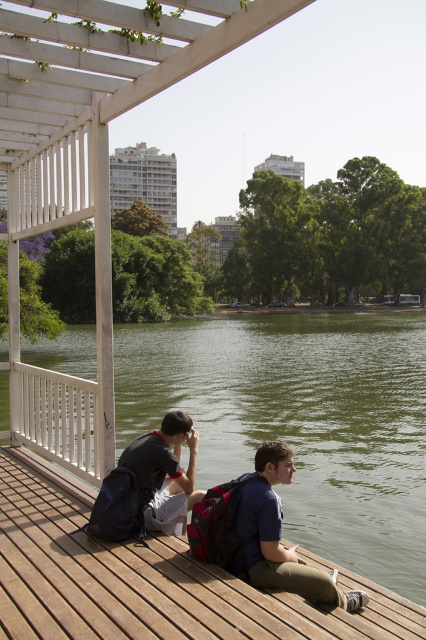
Is wooden at center thinner than dark gray backpack at lower left?

No, wooden at center is not thinner than dark gray backpack at lower left.

Measure the distance between point [42,492] and camera.

5.74 meters

At what (x,y) coordinates should I click in order to perform the action: click on wooden at center. Please return your answer as a coordinate pair (x, y). This screenshot has height=640, width=426. Looking at the image, I should click on (149, 579).

Consider the image. Which is more to the left, blue fabric shirt at center or dark gray backpack at lower left?

Positioned to the left is dark gray backpack at lower left.

Can you confirm if blue fabric shirt at center is smaller than dark gray backpack at lower left?

No.

Which is behind, point (267, 464) or point (160, 506)?

The point (160, 506) is more distant.

At what (x,y) coordinates should I click in order to perform the action: click on blue fabric shirt at center. Please return your answer as a coordinate pair (x, y). Looking at the image, I should click on (278, 536).

Between wooden at center and blue fabric shirt at center, which one appears on the left side from the viewer's perspective?

wooden at center is more to the left.

Is point (282, 636) closer to camera compared to point (264, 467)?

Yes.

This screenshot has height=640, width=426. Identify the location of wooden at center. (149, 579).